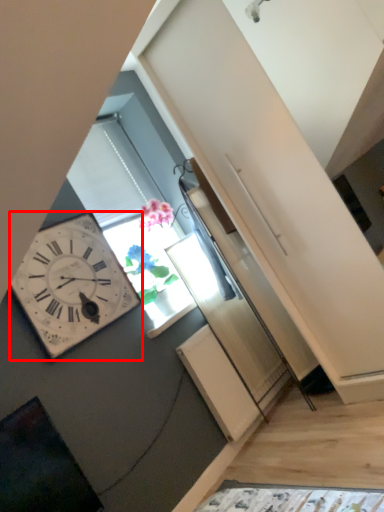
Question: Considering the relative positions of wall clock (annotated by the red box) and window in the image provided, where is wall clock (annotated by the red box) located with respect to the staircase?

Choices:
 (A) left
 (B) right

Answer: (A)